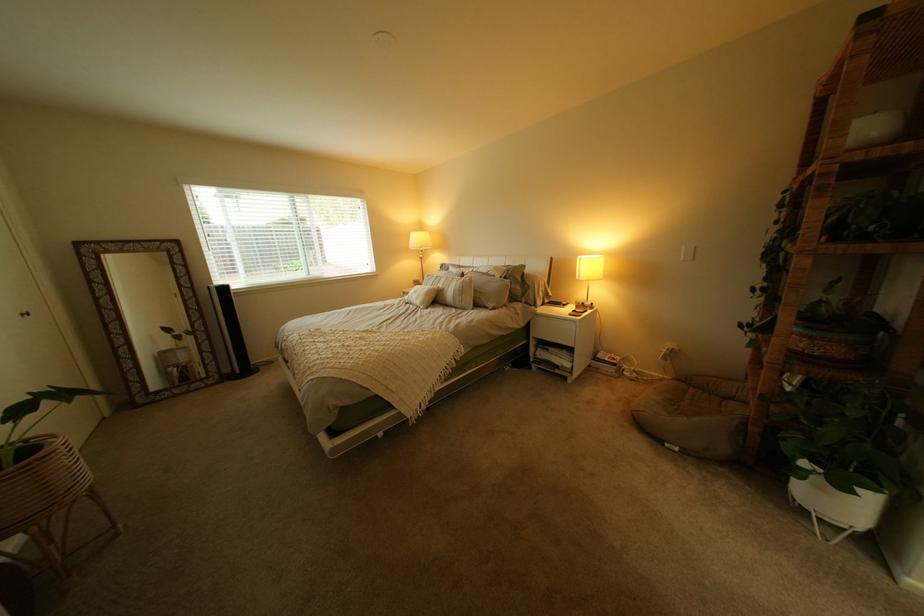
Where is `brown pet bed`? brown pet bed is located at coordinates (391, 342).